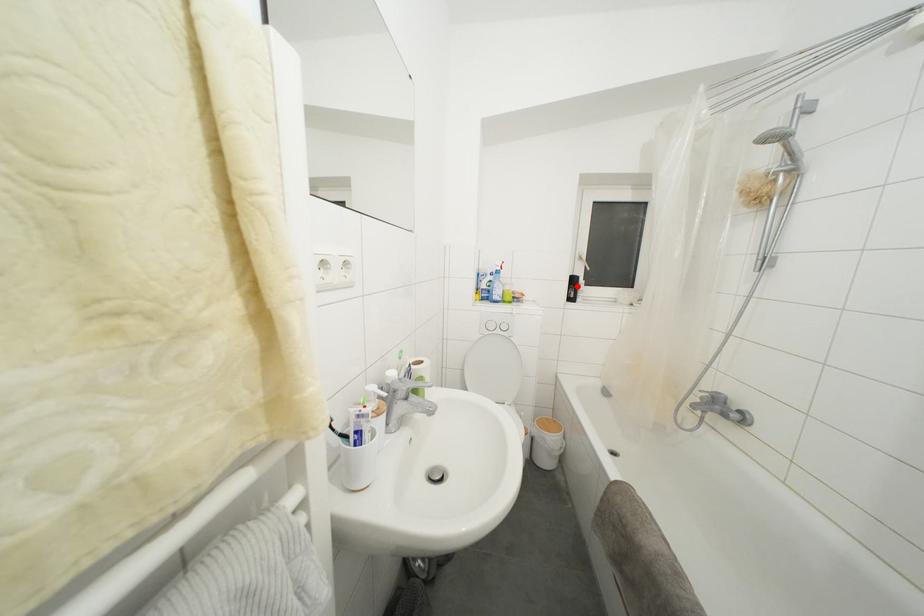
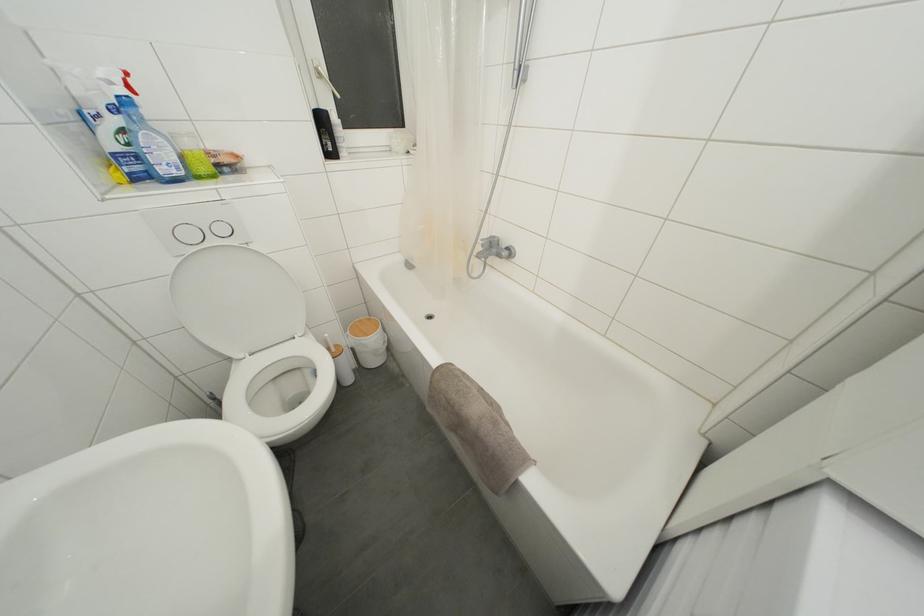
In the second image, find the point that corresponds to the highlighted location in the first image.

(325, 126)